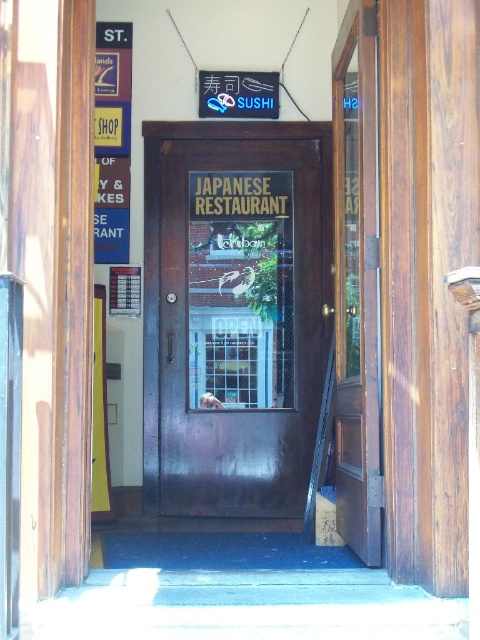
Question: Does dark wood door at center have a greater width compared to metallic signboard at left?

Choices:
 (A) no
 (B) yes

Answer: (B)

Question: Does dark wood door at center appear over metallic signboard at left?

Choices:
 (A) yes
 (B) no

Answer: (B)

Question: Among these points, which one is farthest from the camera?

Choices:
 (A) (349, 452)
 (B) (103, 184)

Answer: (B)

Question: Which point is farther from the camera taking this photo?

Choices:
 (A) (108, 44)
 (B) (363, 77)

Answer: (A)

Question: Can you confirm if mahogany wood door at right is positioned to the left of metallic signboard at left?

Choices:
 (A) no
 (B) yes

Answer: (A)

Question: Which point appears farthest from the camera in this image?

Choices:
 (A) (348, 102)
 (B) (219, 205)
 (C) (126, 236)

Answer: (B)